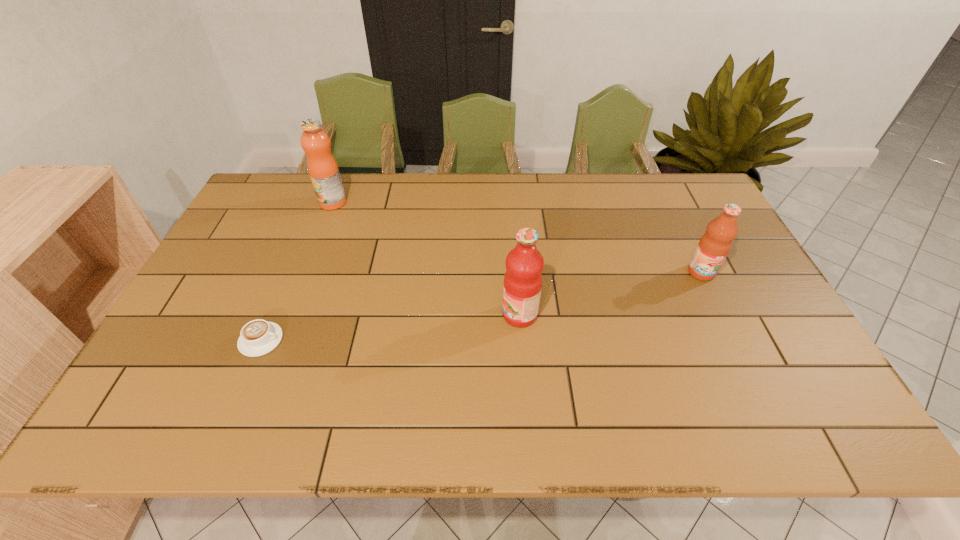
You are a GUI agent. You are given a task and a screenshot of the screen. Output one action in this format:
    pyautogui.click(x=<x>, y=<y>)
    Task: Click on the vacant space located 0.230m on the front label of the third object from left to right
    
    Given the screenshot: What is the action you would take?
    pyautogui.click(x=413, y=315)

Identify the location of vacant space situated 0.180m on the front label of the second farthest object. (732, 335).

Find the location of a particular element. The image size is (960, 540). vacant area situated 0.140m with the handle on the right side of the cappuccino is located at coordinates (339, 340).

Locate an element on the screen. This screenshot has height=540, width=960. object at the far edge is located at coordinates (322, 167).

This screenshot has width=960, height=540. In order to click on object that is at the right edge in this screenshot , I will do `click(713, 247)`.

Image resolution: width=960 pixels, height=540 pixels. In the image, there is a desktop. What are the coordinates of `vacant space at the far edge` in the screenshot? It's located at (301, 213).

This screenshot has width=960, height=540. What are the coordinates of `blank space at the near edge of the desktop` in the screenshot? It's located at (620, 415).

Identify the location of free space at the left edge. Image resolution: width=960 pixels, height=540 pixels. (221, 249).

In the image, there is a desktop. Where is `vacant space at the right edge`? vacant space at the right edge is located at coordinates (748, 280).

Image resolution: width=960 pixels, height=540 pixels. What are the coordinates of `free space between the rightmost object and the third object from left to right` in the screenshot? It's located at (611, 294).